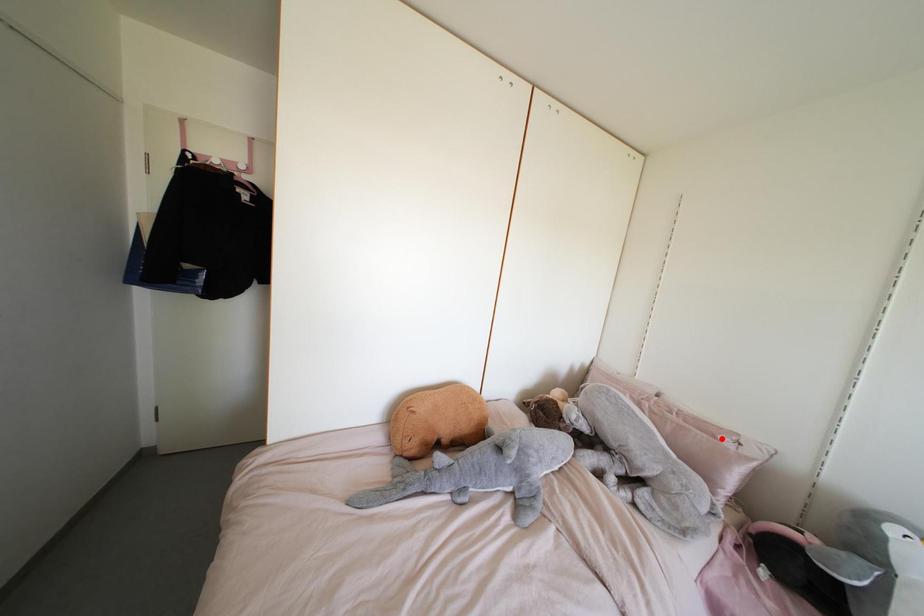
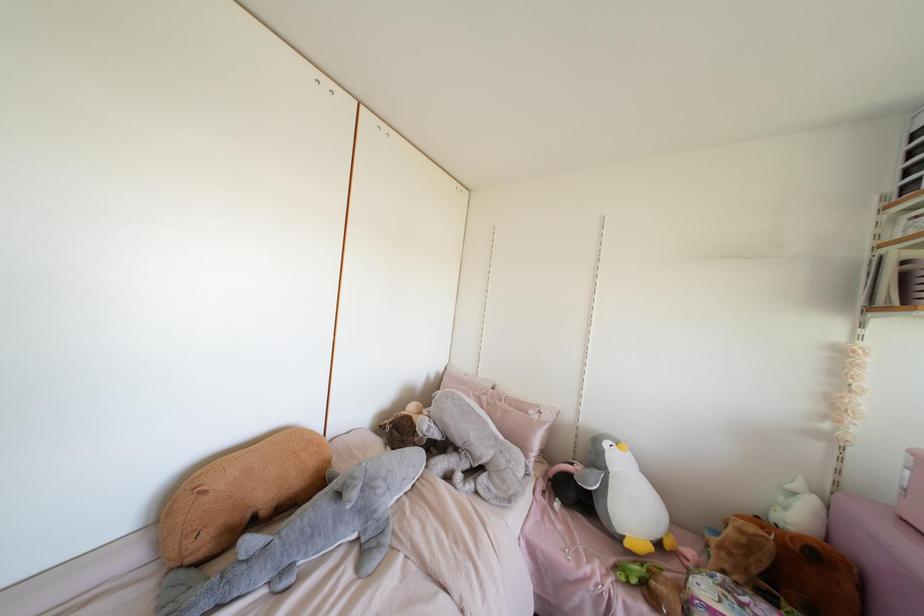
Find the pixel in the second image that matches the highlighted location in the first image.

(530, 411)